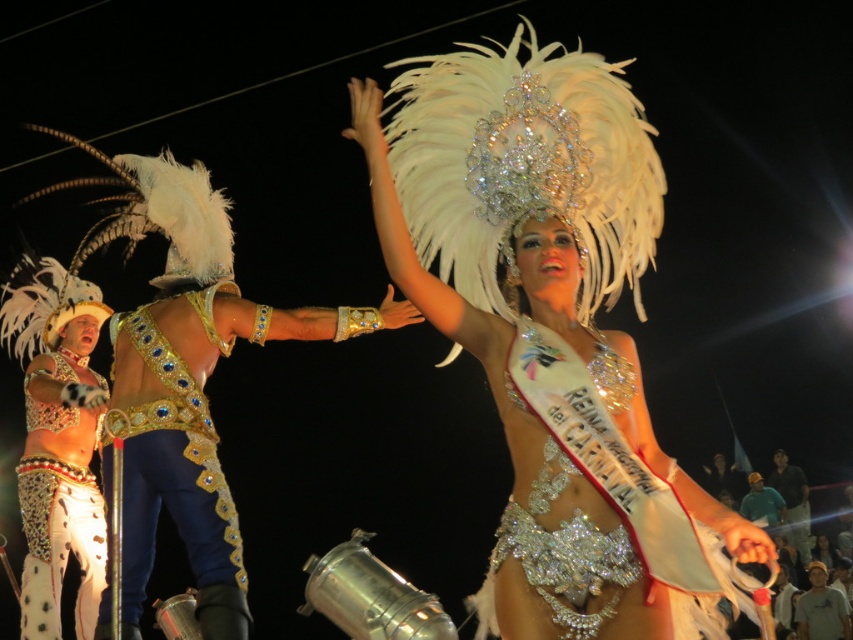
Question: Does white feathered headdress at upper center have a lesser width compared to dark blue jeans at center?

Choices:
 (A) no
 (B) yes

Answer: (A)

Question: Considering the real-world distances, which object is closest to the dark blue jeans at center?

Choices:
 (A) white leopard print pants at center
 (B) white feathered headdress at upper center
 (C) sparkling silver belt at center

Answer: (A)

Question: Which point is closer to the camera taking this photo?

Choices:
 (A) (517, 372)
 (B) (590, 88)

Answer: (A)

Question: Can you confirm if sparkling silver belt at center is bigger than gold sequined belt at center?

Choices:
 (A) no
 (B) yes

Answer: (A)

Question: Which point is farther to the camera?

Choices:
 (A) (772, 492)
 (B) (44, 472)
 (C) (125, 538)

Answer: (A)

Question: Does white leopard print pants at center lie behind dark blue jeans at center?

Choices:
 (A) no
 (B) yes

Answer: (A)